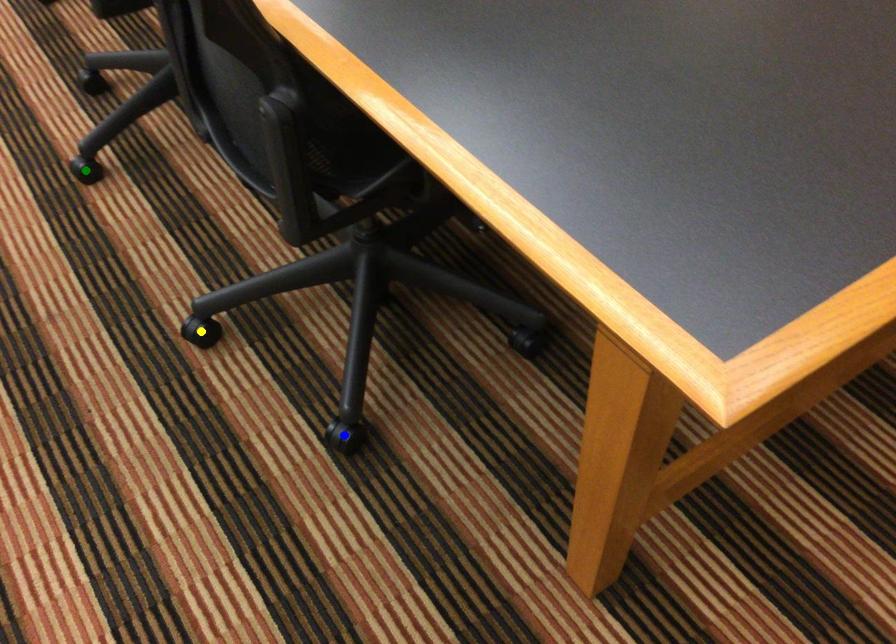
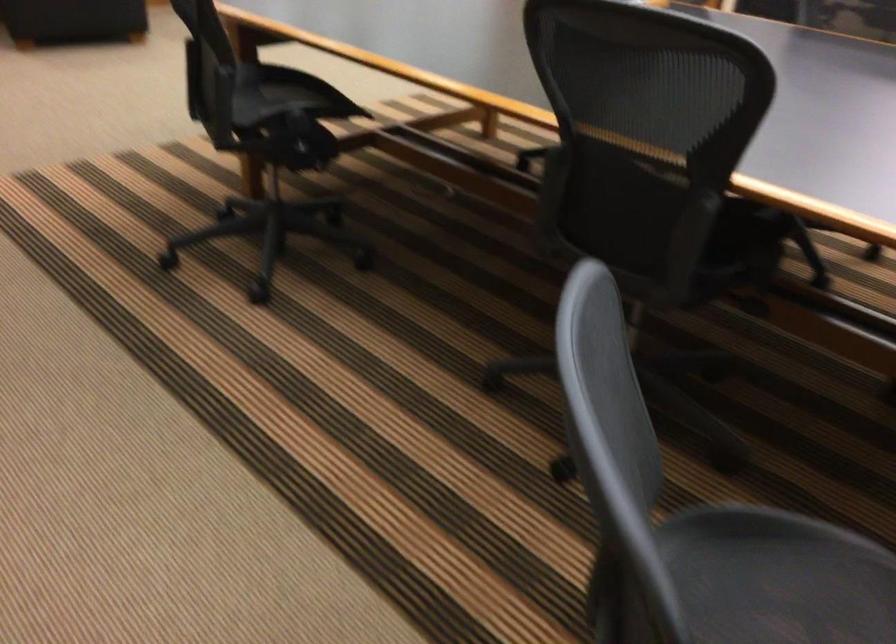
I am providing you with two images of the same scene from different viewpoints. Three points are marked in image1. Which point corresponds to a part or object that is occluded in image2?In image1, three points are marked. Which of them correspond to a part or object that is occluded in image2?Among the three points shown in image1, which one corresponds to a part or object that is no longer visible due to occlusion in image2?

yellow point, blue point, green point